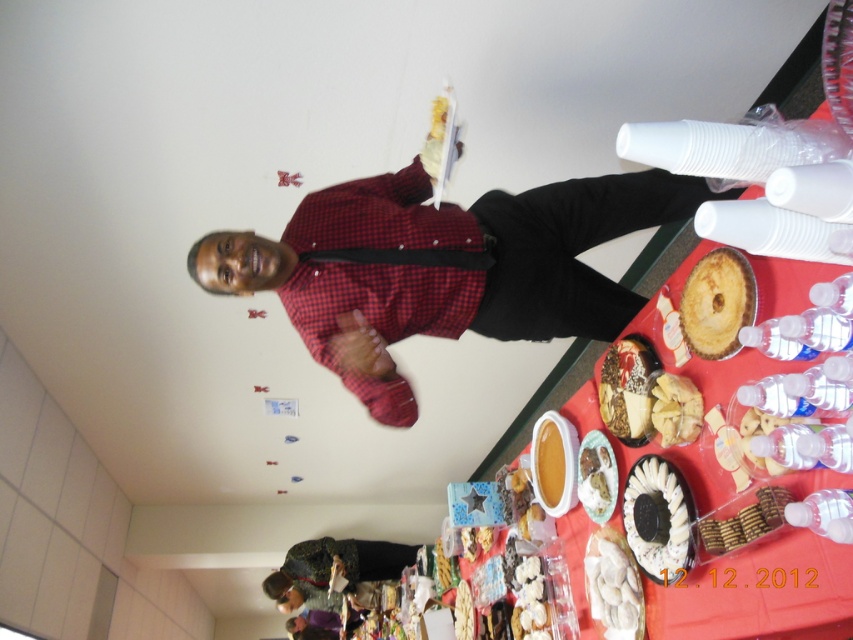
Question: Which object is farther from the camera taking this photo?

Choices:
 (A) white creamy cake at center
 (B) white glossy dumplings at center

Answer: (A)

Question: Is red checkered shirt at center to the right of smooth brown cookies at lower right from the viewer's perspective?

Choices:
 (A) yes
 (B) no

Answer: (B)

Question: Can you confirm if white crumbly cake at center is positioned to the left of white creamy cake at center?

Choices:
 (A) no
 (B) yes

Answer: (A)

Question: Which object appears closest to the camera in this image?

Choices:
 (A) white crumbly cake at center
 (B) camouflage jacket at lower center
 (C) yellow matte cake at lower center
 (D) white creamy cake at center

Answer: (A)

Question: Is smooth brown cookies at lower right behind white crumbly cake at center?

Choices:
 (A) no
 (B) yes

Answer: (A)

Question: Which of the following is the farthest from the observer?

Choices:
 (A) red checkered shirt at center
 (B) white glossy dumplings at center
 (C) yellow matte cake at lower center
 (D) white creamy cake at center

Answer: (C)